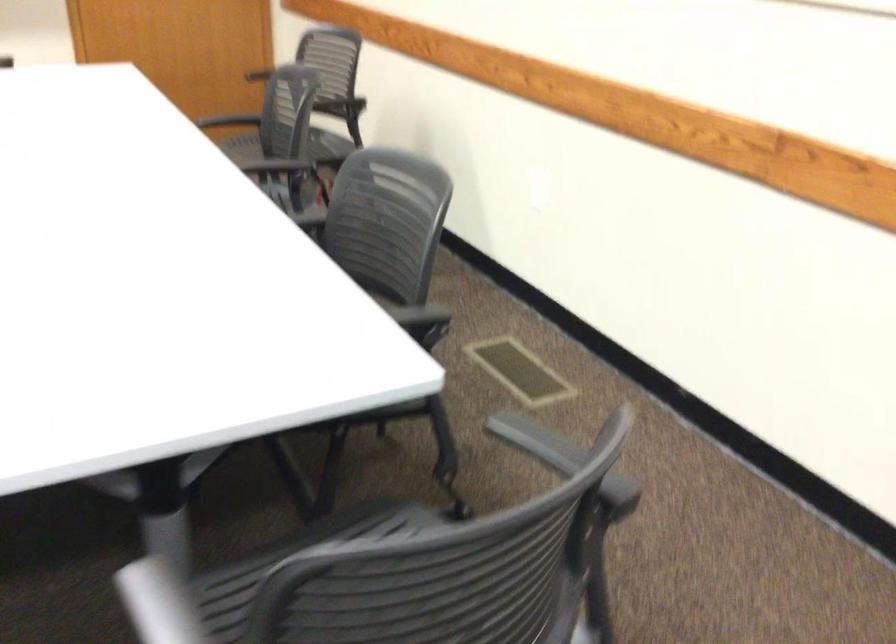
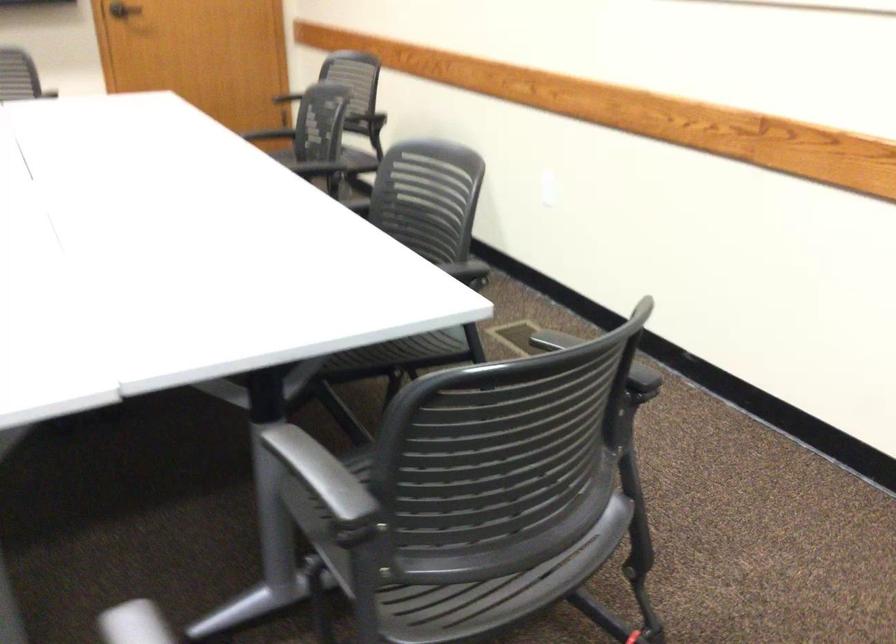
The point at (541,203) is marked in the first image. Where is the corresponding point in the second image?

(547, 196)